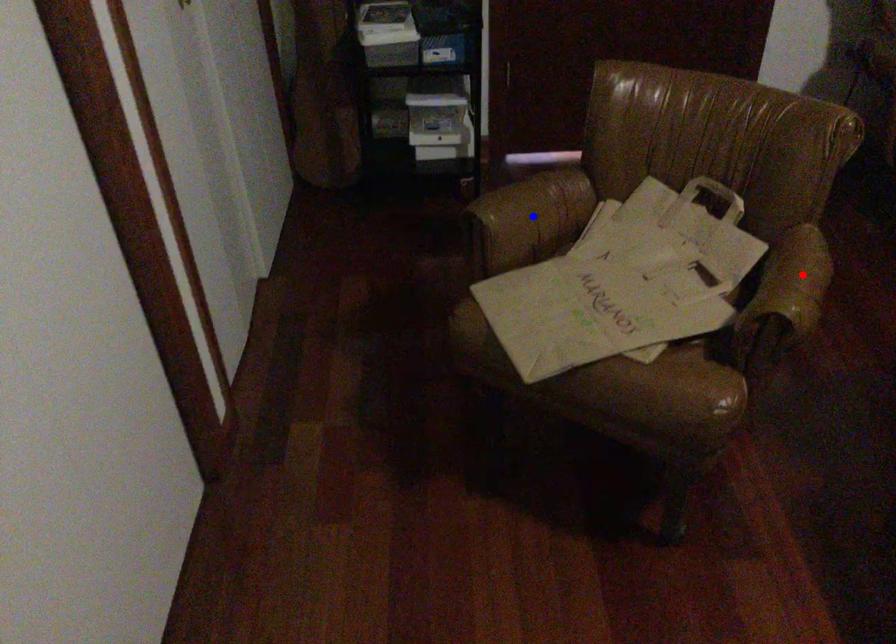
Question: Which of the two points in the image is closer to the camera?

Choices:
 (A) Blue point is closer.
 (B) Red point is closer.

Answer: (B)